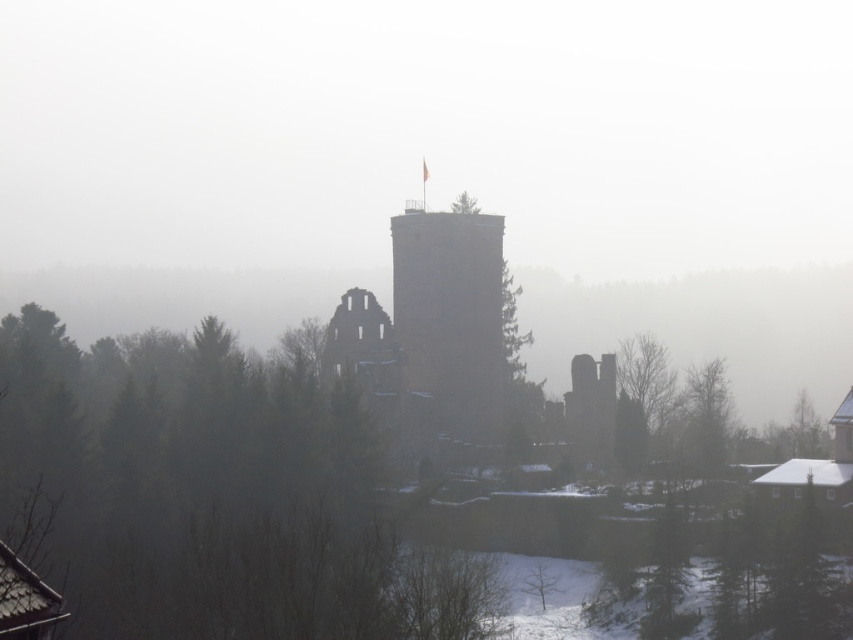
You are an architect analyzing the castle ruins. Based on the scene, which object occupies more horizontal space between the brown stone tower at center and the green leafy tree at right?

The brown stone tower at center has a larger width than the green leafy tree at right, so it occupies more horizontal space.

You are a hiker who wants to take a photo of the brown stone tower at center and the green leafy tree at right in the same frame. Your camera has a maximum zoom range that can capture objects up to 25 meters apart. Will you be able to capture both in one photo?

The brown stone tower at center and green leafy tree at right are 25.91 meters apart from each other. Since your camera can only capture up to 25 meters, you won not be able to capture both in one photo.